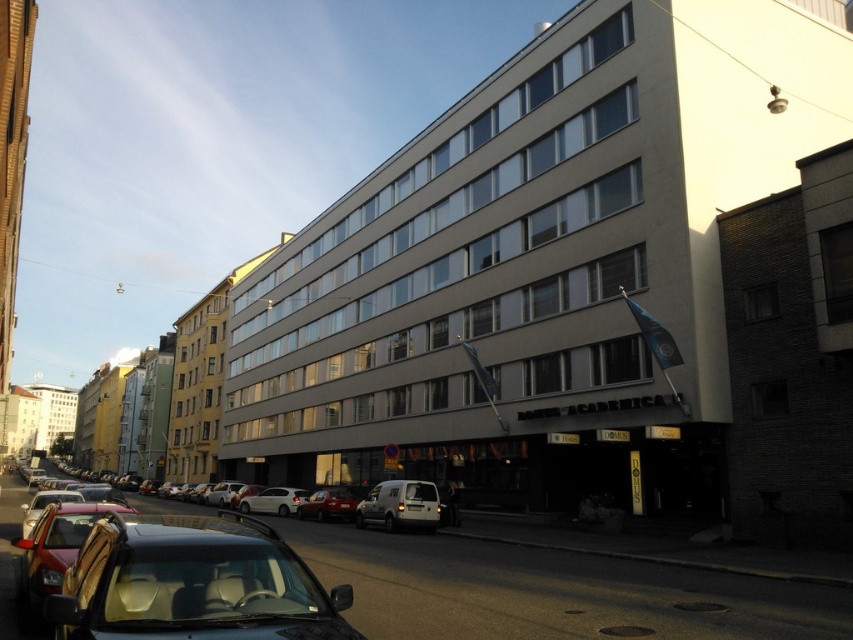
You are a pedestrian standing on the sidewalk and want to cross the street to reach the building. Which car, the shiny black car at lower left or the matte silver hatchback at center, is closer to the building?

The shiny black car at lower left is closer to the building because it is located above the matte silver hatchback at center, meaning it is positioned nearer in the scene.

You are a delivery driver who needs to park your truck, which is 6 meters long, in the space between the matte silver hatchback at center and the white matte car at center. Based on the scene description, can your truck fit in that space?

The matte silver hatchback at center is shorter than the white matte car at center, but the description does not provide information about the length of the space between them. Therefore, it is impossible to determine if the truck can fit based on the given information.

You are a delivery driver who needs to park your vehicle in this parking spot. The parking space is designed to accommodate vehicles up to 4.5 meters in length. You have two options to choose from for your delivery van, which is 5 meters long. Which vehicle among the shiny red car at lower left and the matte silver hatchback at center would you use as a reference to decide if the space is suitable for your van?

The shiny red car at lower left is shorter than the matte silver hatchback at center. Since your van is 5 meters long, you should check the length of the matte silver hatchback at center. If it fits in the space, your van might also fit, but if the hatchback is already at the maximum length, the space may be too small.